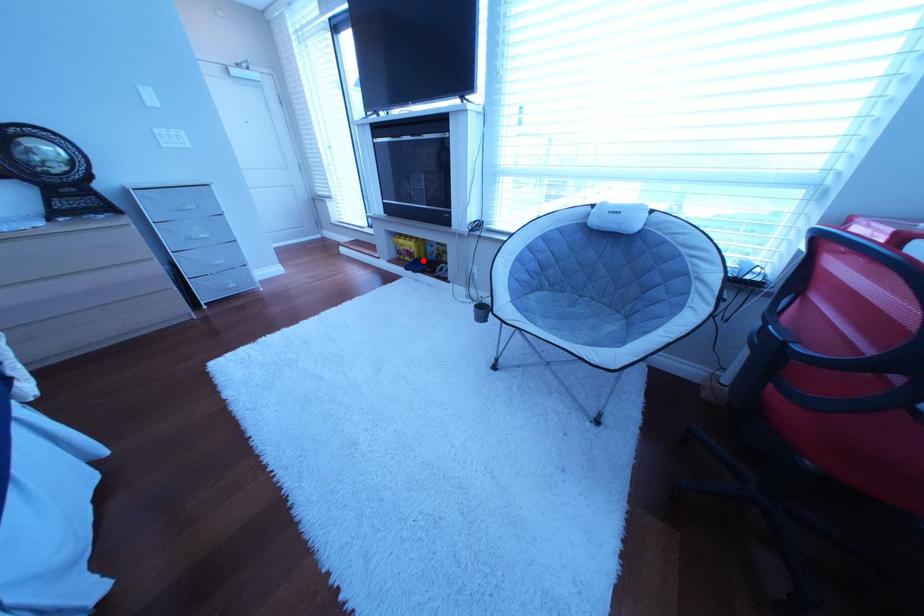
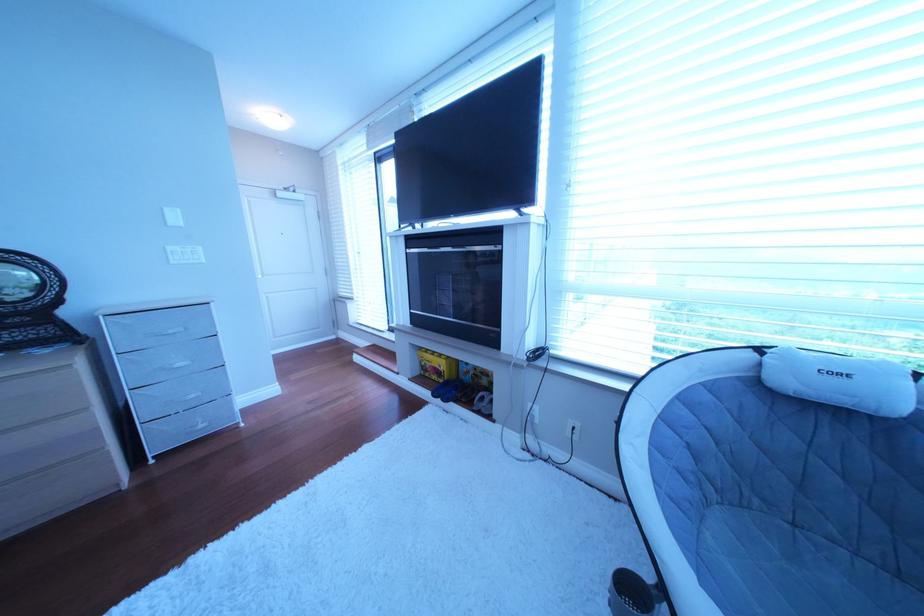
Find the pixel in the second image that matches the highlighted location in the first image.

(450, 379)